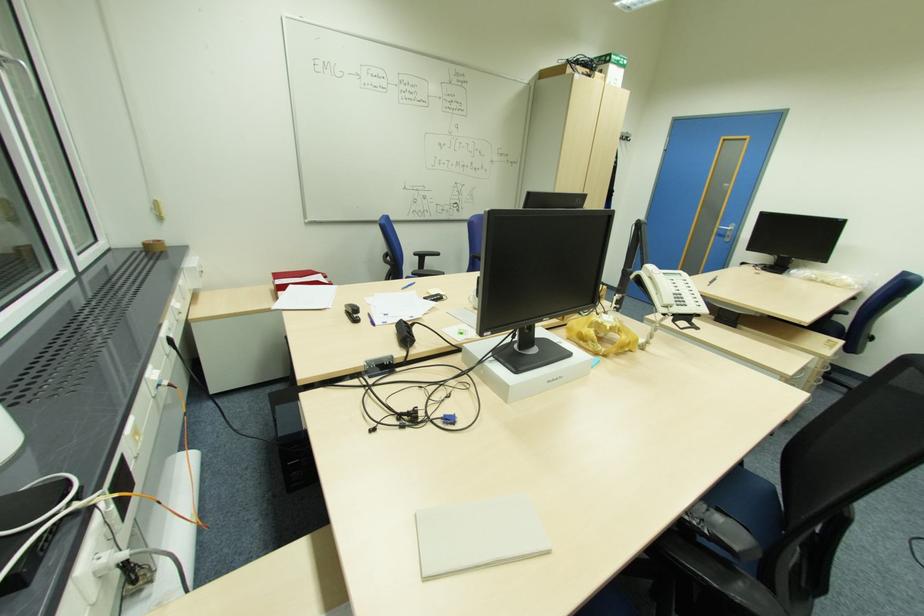
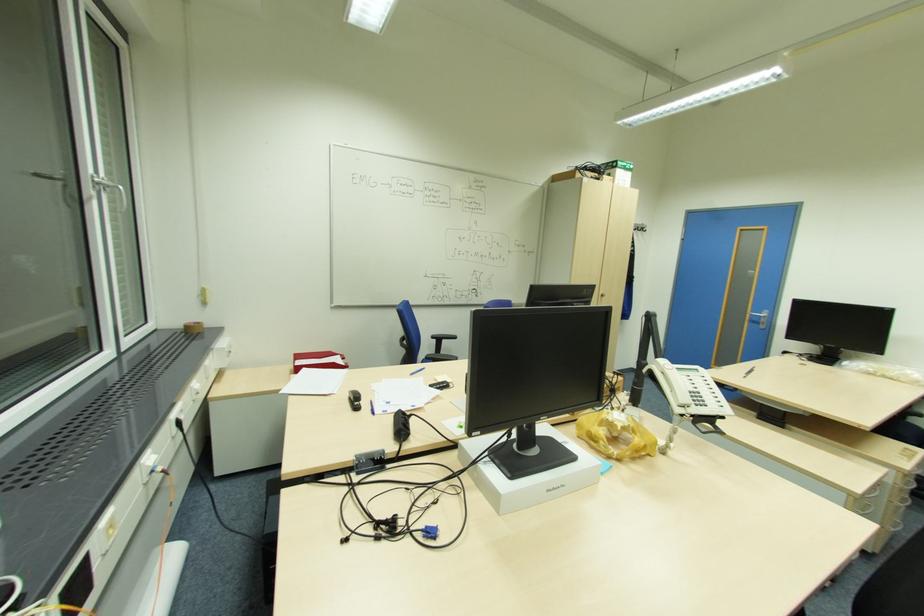
Where in the second image is the point corresponding to point (359, 321) from the first image?

(359, 408)